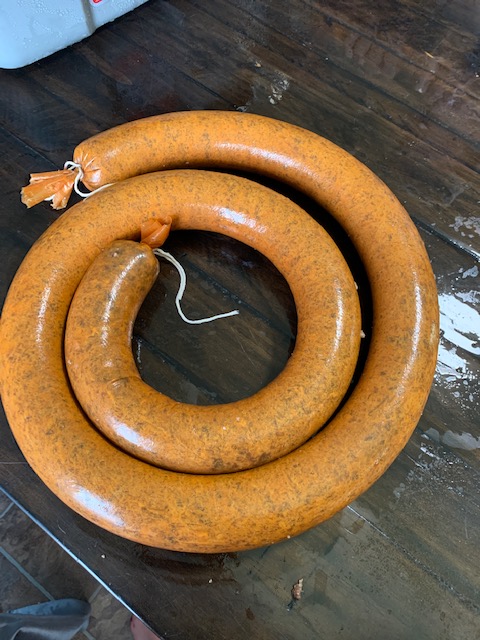
This screenshot has width=480, height=640. I want to click on chair leg, so click(x=66, y=625).